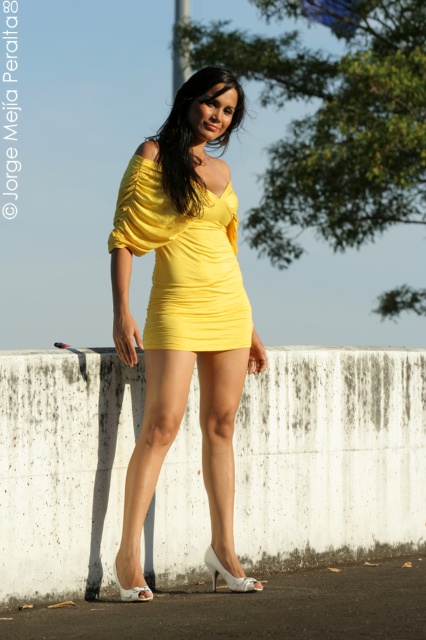
Looking at this image, you are a fashion designer observing the image. You notice two versions of the same dress, the matte yellow dress at center and the yellow matte dress at center. Which one is taller?

The matte yellow dress at center has a greater height compared to the yellow matte dress at center.

You are a fashion designer looking at the image of a person wearing two yellow dresses. You notice both dresses are labeled as matte yellow dress at center and yellow matte dress at center. Which one is bigger?

The matte yellow dress at center is larger in size compared to the yellow matte dress at center.